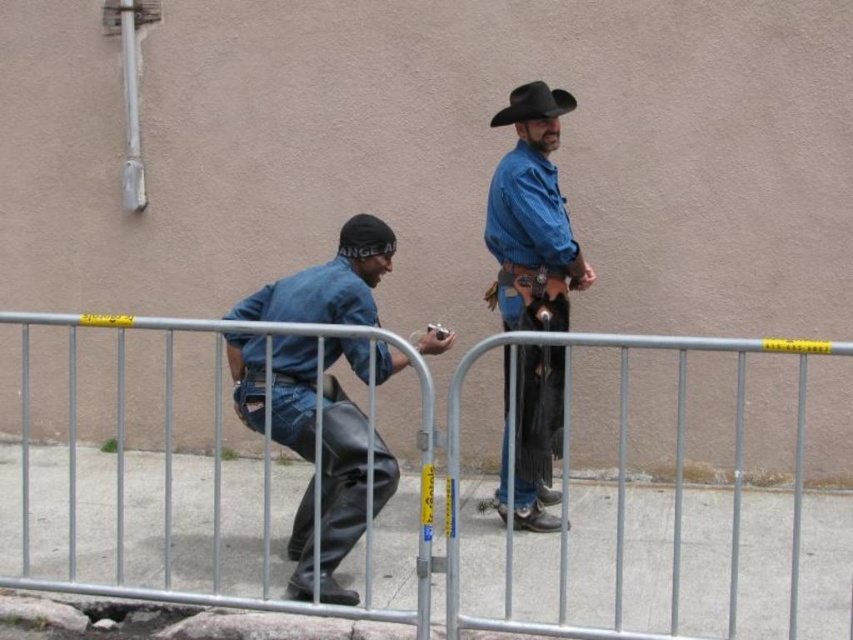
Is point (160, 467) closer to camera compared to point (286, 307)?

That is False.

Is metal at center thinner than matte blue shirt at center?

In fact, metal at center might be wider than matte blue shirt at center.

Is point (677, 529) positioned after point (322, 497)?

No.

The image size is (853, 640). What are the coordinates of `metal at center` in the screenshot? It's located at (422, 506).

Is metal at center to the right of black felt cowboy hat at upper center from the viewer's perspective?

Incorrect, metal at center is not on the right side of black felt cowboy hat at upper center.

Which is more to the right, metal at center or black felt cowboy hat at upper center?

Positioned to the right is black felt cowboy hat at upper center.

Who is more forward, (647, 563) or (520, 99)?

Point (647, 563) is in front.

Image resolution: width=853 pixels, height=640 pixels. Find the location of `metal at center`. metal at center is located at coordinates (422, 506).

At what (x,y) coordinates should I click in order to perform the action: click on metal at center. Please return your answer as a coordinate pair (x, y). Looking at the image, I should click on (422, 506).

This screenshot has width=853, height=640. What do you see at coordinates (422, 506) in the screenshot? I see `metal at center` at bounding box center [422, 506].

Which is in front, point (766, 573) or point (561, 428)?

Point (766, 573)

Identify the location of metal at center. (422, 506).